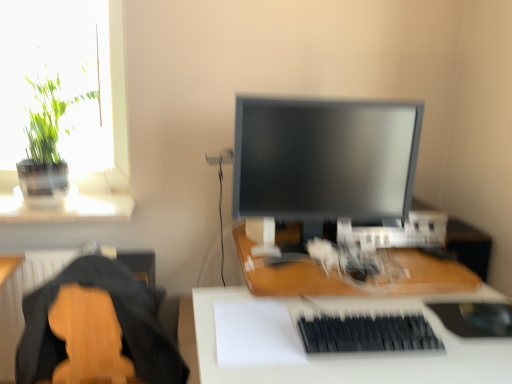
Find the location of a particular element. free location in front of black matte keyboard at lower center is located at coordinates point(386,370).